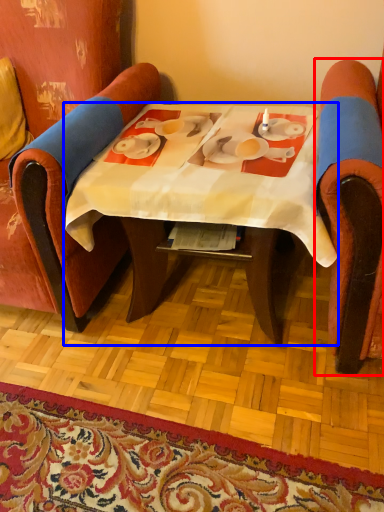
Question: Which object is further to the camera taking this photo, chair (highlighted by a red box) or table (highlighted by a blue box)?

Choices:
 (A) chair
 (B) table

Answer: (B)